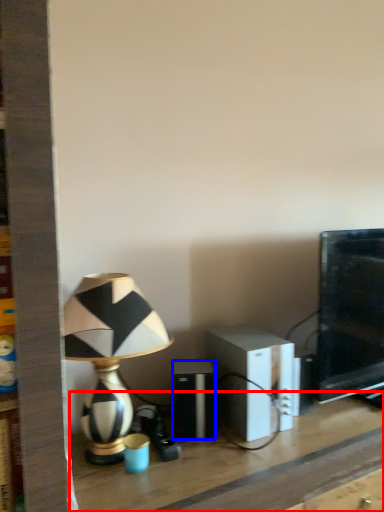
Question: Which point is further to the camera, table (highlighted by a red box) or speaker (highlighted by a blue box)?

Choices:
 (A) table
 (B) speaker

Answer: (B)